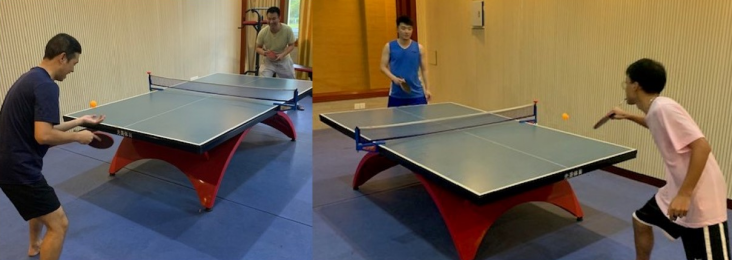
The width and height of the screenshot is (732, 260). I want to click on back table legs, so click(356, 181), click(296, 138).